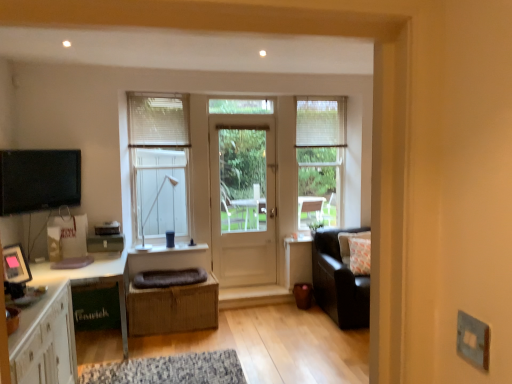
The width and height of the screenshot is (512, 384). I want to click on free space above white wooden door at center (from a real-world perspective), so click(x=242, y=120).